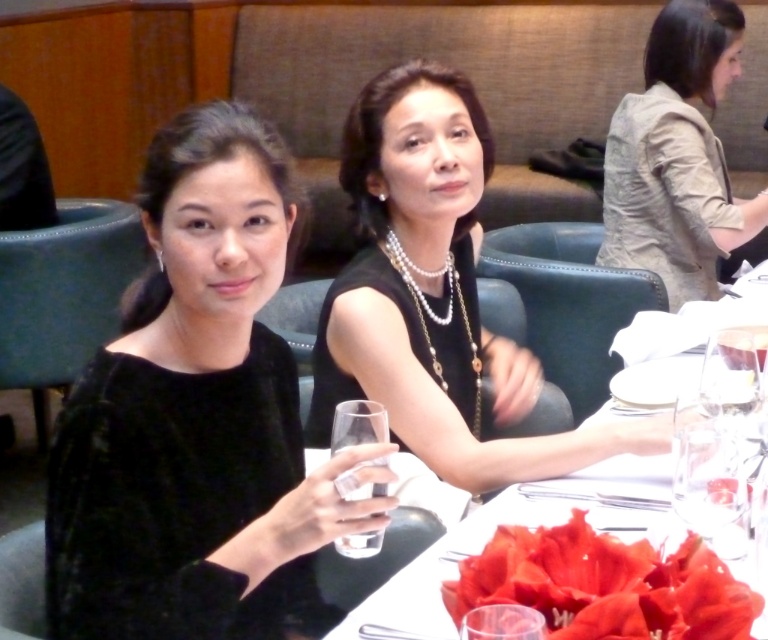
Question: Can you confirm if beige textured blazer at upper right is bigger than clear glass at center?

Choices:
 (A) no
 (B) yes

Answer: (B)

Question: Is beige textured blazer at upper right bigger than glassy clear water at center?

Choices:
 (A) no
 (B) yes

Answer: (B)

Question: Is black velvet dress at center in front of glassy clear water at center?

Choices:
 (A) no
 (B) yes

Answer: (A)

Question: Among these points, which one is farthest from the camera?

Choices:
 (A) (714, 294)
 (B) (535, 625)
 (C) (568, 448)
 (D) (371, 496)

Answer: (A)

Question: Which point is closer to the camera taking this photo?

Choices:
 (A) (368, 365)
 (B) (63, 544)
 (C) (369, 300)

Answer: (B)

Question: Estimate the real-world distances between objects in this image. Which object is closer to the clear glass at center?

Choices:
 (A) black velvet dress at center
 (B) beige textured blazer at upper right
 (C) glassy clear water at center
 (D) transparent glass at center

Answer: (D)